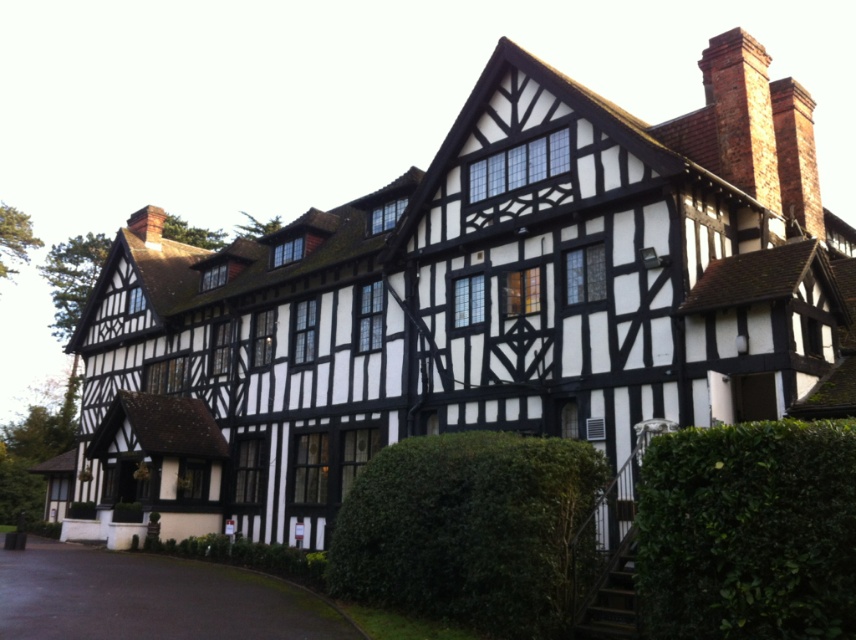
Is green leafy hedge at center wider than brick chimney at upper right?

Correct, the width of green leafy hedge at center exceeds that of brick chimney at upper right.

Is green leafy hedge at center to the left of brick chimney at upper right from the viewer's perspective?

Indeed, green leafy hedge at center is positioned on the left side of brick chimney at upper right.

Does point (542, 461) come behind point (747, 35)?

No, (542, 461) is closer to viewer.

Locate an element on the screen. green leafy hedge at center is located at coordinates (468, 529).

Is black asphalt driveway at lower left thinner than brick chimney at upper right?

No.

Does point (64, 566) come farther from viewer compared to point (722, 154)?

Yes.

Which is behind, point (129, 634) or point (744, 132)?

Positioned behind is point (744, 132).

Where is `black asphalt driveway at lower left`? black asphalt driveway at lower left is located at coordinates (149, 598).

Does black asphalt driveway at lower left have a greater height compared to red brick chimney at upper right?

No.

Is point (36, 637) closer to camera compared to point (801, 192)?

Yes, it is.

Is point (79, 552) behind point (815, 182)?

Yes, point (79, 552) is farther from viewer.

Locate an element on the screen. The image size is (856, 640). black asphalt driveway at lower left is located at coordinates (149, 598).